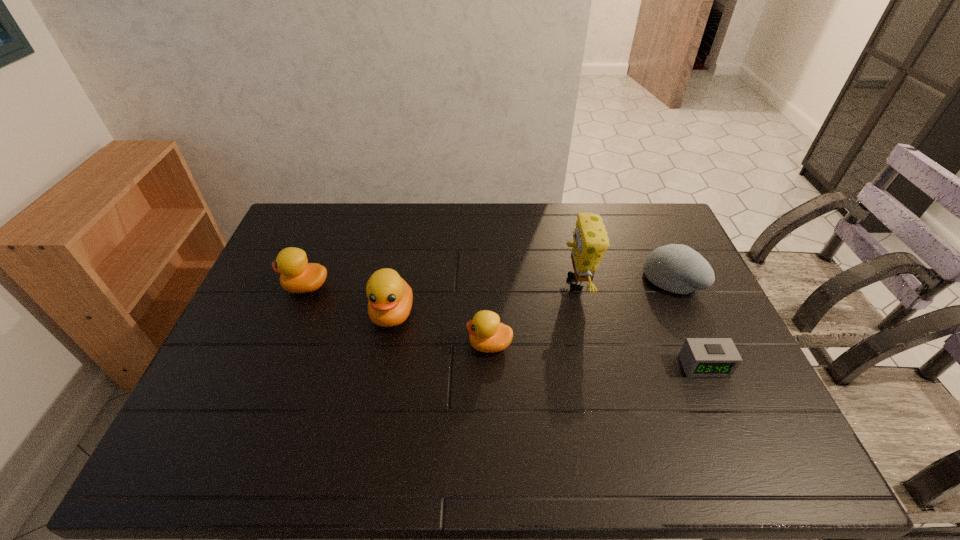
What are the coordinates of `empty location between the second object from left to right and the alarm clock` in the screenshot? It's located at (548, 340).

The width and height of the screenshot is (960, 540). What are the coordinates of `vacant area that lies between the second duckling from left to right and the beanie` in the screenshot? It's located at (532, 296).

Where is `free spot between the beanie and the shortest object`? free spot between the beanie and the shortest object is located at coordinates (687, 322).

What are the coordinates of `empty space that is in between the beanie and the sponge` in the screenshot? It's located at (624, 281).

Locate an element on the screen. This screenshot has height=540, width=960. the fourth closest object to the shortest object is located at coordinates (390, 298).

Where is `the fourth closest object to the beanie`? the fourth closest object to the beanie is located at coordinates (390, 298).

This screenshot has height=540, width=960. I want to click on duckling that can be found as the second closest to the rightmost duckling, so click(297, 275).

What are the coordinates of `the third closest duckling to the tallest object` in the screenshot? It's located at coord(297,275).